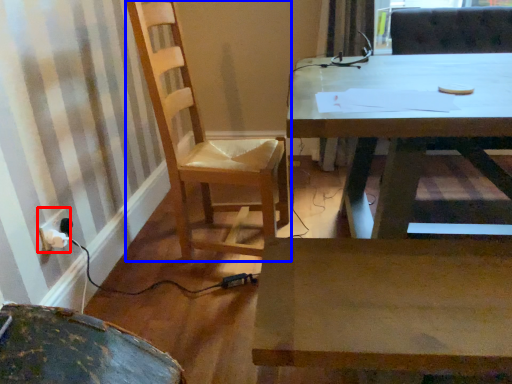
Question: Which object is closer to the camera taking this photo, electric outlet (highlighted by a red box) or chair (highlighted by a blue box)?

Choices:
 (A) electric outlet
 (B) chair

Answer: (B)